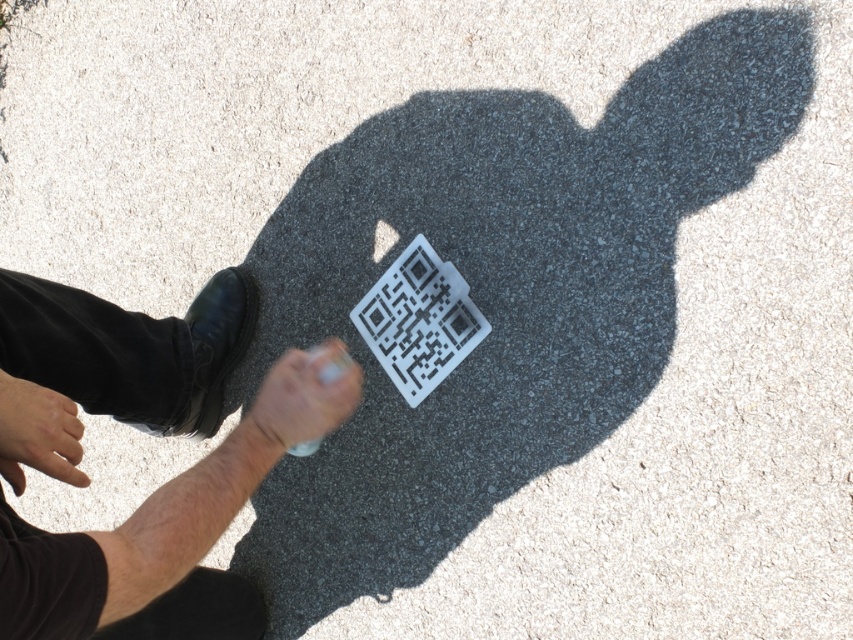
Does black leather shoe at lower left have a greater height compared to smooth skin hand at lower left?

Correct, black leather shoe at lower left is much taller as smooth skin hand at lower left.

Is black leather shoe at lower left positioned in front of smooth skin hand at lower left?

That is True.

Who is more forward, (213, 312) or (70, 403)?

Positioned in front is point (70, 403).

Find the location of a particular element. This screenshot has width=853, height=640. black leather shoe at lower left is located at coordinates coord(169,531).

Can you confirm if black leather shoe at lower left is shorter than transparent plastic qr code at center?

Incorrect, black leather shoe at lower left's height does not fall short of transparent plastic qr code at center's.

Which is in front, point (0, 282) or point (403, 323)?

Positioned in front is point (0, 282).

Measure the distance between point [115,346] and camera.

Point [115,346] and camera are 4.69 feet apart.

Image resolution: width=853 pixels, height=640 pixels. Identify the location of black leather shoe at lower left. click(x=169, y=531).

Does point (344, 346) come in front of point (38, 461)?

No, (344, 346) is behind (38, 461).

How distant is white matte hand at center from smooth skin hand at lower left?

white matte hand at center is 12.64 inches from smooth skin hand at lower left.

The width and height of the screenshot is (853, 640). What do you see at coordinates (306, 396) in the screenshot?
I see `white matte hand at center` at bounding box center [306, 396].

This screenshot has width=853, height=640. I want to click on white matte hand at center, so click(306, 396).